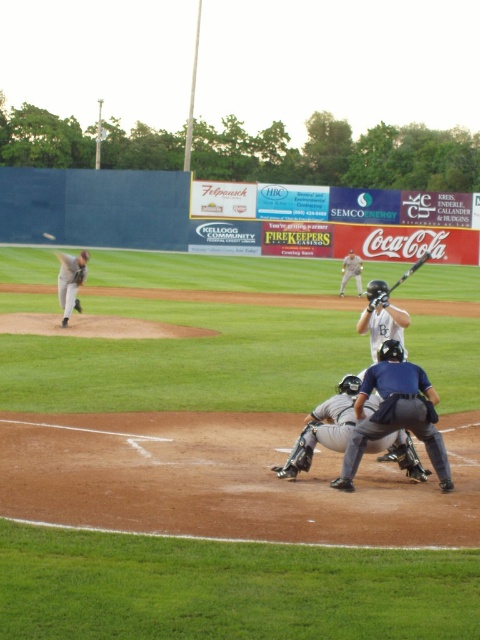
Question: Is gray matte catcher at center positioned before black matte bat at center?

Choices:
 (A) no
 (B) yes

Answer: (B)

Question: Which object is the closest to the white uniformed player at center?

Choices:
 (A) brown leather glove at left
 (B) gray uniformed pitcher at left

Answer: (B)

Question: Can you confirm if blue fabric umpire at center is bigger than black matte bat at center?

Choices:
 (A) no
 (B) yes

Answer: (A)

Question: Is blue fabric umpire at center further to camera compared to white matte baseball at center?

Choices:
 (A) yes
 (B) no

Answer: (B)

Question: Estimate the real-world distances between objects in this image. Which object is farther from the black leather glove at center?

Choices:
 (A) gray uniformed pitcher at left
 (B) white matte baseball at center
 (C) blue fabric umpire at center

Answer: (B)

Question: Which point is closer to the camera?

Choices:
 (A) (359, 262)
 (B) (411, 451)
 (C) (414, 269)

Answer: (B)